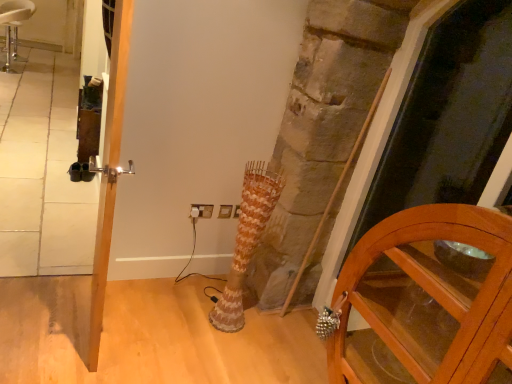
Question: Does white plastic electric outlet at center contain polished silver door handle at left?

Choices:
 (A) yes
 (B) no

Answer: (B)

Question: Can you confirm if white plastic electric outlet at center is taller than polished silver door handle at left?

Choices:
 (A) yes
 (B) no

Answer: (B)

Question: From a real-world perspective, is white plastic electric outlet at center positioned under polished silver door handle at left based on gravity?

Choices:
 (A) yes
 (B) no

Answer: (A)

Question: Is white plastic electric outlet at center at the right side of polished silver door handle at left?

Choices:
 (A) no
 (B) yes

Answer: (B)

Question: Can you confirm if white plastic electric outlet at center is thinner than polished silver door handle at left?

Choices:
 (A) no
 (B) yes

Answer: (B)

Question: Is there a large distance between white plastic electric outlet at center and polished silver door handle at left?

Choices:
 (A) no
 (B) yes

Answer: (B)

Question: From a real-world perspective, is white leather stool at upper left under transparent glass screen door at right?

Choices:
 (A) yes
 (B) no

Answer: (A)

Question: Would you say white leather stool at upper left is outside transparent glass screen door at right?

Choices:
 (A) yes
 (B) no

Answer: (A)

Question: Is white leather stool at upper left smaller than transparent glass screen door at right?

Choices:
 (A) no
 (B) yes

Answer: (B)

Question: Can you confirm if white leather stool at upper left is positioned to the right of transparent glass screen door at right?

Choices:
 (A) yes
 (B) no

Answer: (B)

Question: Does white leather stool at upper left have a greater width compared to transparent glass screen door at right?

Choices:
 (A) yes
 (B) no

Answer: (A)

Question: Could you tell me if white leather stool at upper left is facing transparent glass screen door at right?

Choices:
 (A) yes
 (B) no

Answer: (B)

Question: Considering the relative sizes of wooden cabinet at lower right and polished silver door handle at left in the image provided, is wooden cabinet at lower right bigger than polished silver door handle at left?

Choices:
 (A) no
 (B) yes

Answer: (B)